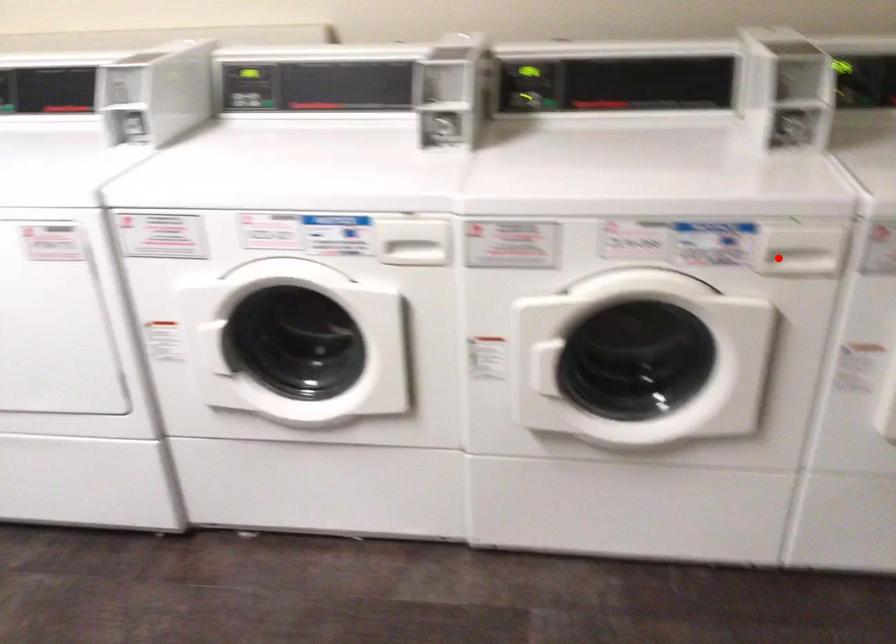
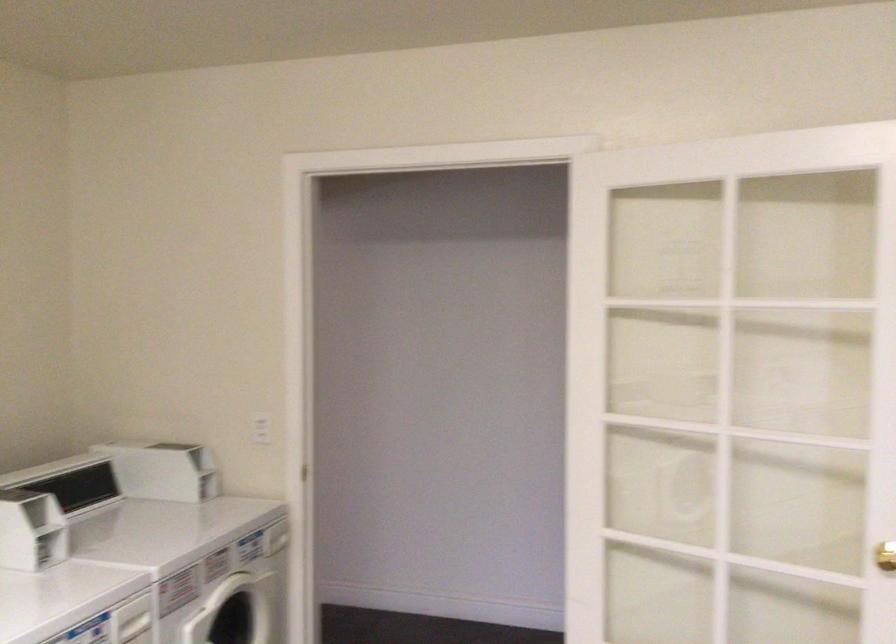
Locate, in the second image, the point that corresponds to the highlighted location in the first image.

(133, 621)